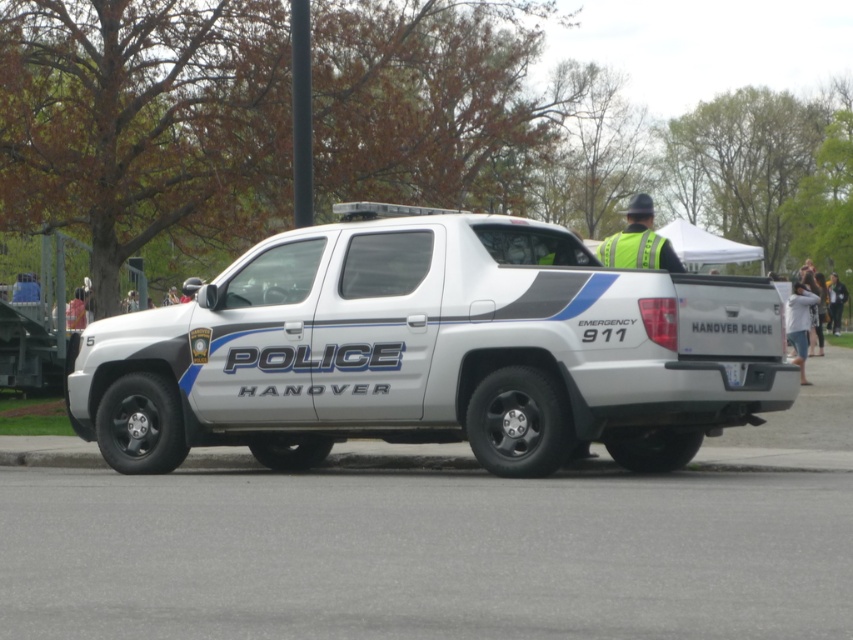
Does white glossy police car at center have a lesser width compared to yellow reflective vest at upper right?

In fact, white glossy police car at center might be wider than yellow reflective vest at upper right.

Can you confirm if white glossy police car at center is wider than yellow reflective vest at upper right?

Yes.

This screenshot has width=853, height=640. Describe the element at coordinates (430, 349) in the screenshot. I see `white glossy police car at center` at that location.

The height and width of the screenshot is (640, 853). I want to click on white glossy police car at center, so click(430, 349).

From the picture: Is yellow reflective vest at upper right positioned behind white plastic license plate at rear?

No, it is in front of white plastic license plate at rear.

Is yellow reflective vest at upper right to the left of white plastic license plate at rear from the viewer's perspective?

Correct, you'll find yellow reflective vest at upper right to the left of white plastic license plate at rear.

Where is `yellow reflective vest at upper right`? The height and width of the screenshot is (640, 853). yellow reflective vest at upper right is located at coordinates (637, 241).

This screenshot has width=853, height=640. What are the coordinates of `yellow reflective vest at upper right` in the screenshot? It's located at (637, 241).

Between point (525, 433) and point (733, 387), which one is positioned behind?

Point (525, 433)

Does point (276, 344) lie behind point (740, 376)?

Yes, it is.

Who is more forward, (512, 342) or (722, 364)?

Point (512, 342) is more forward.

Where is `white glossy police car at center`? The width and height of the screenshot is (853, 640). white glossy police car at center is located at coordinates (430, 349).